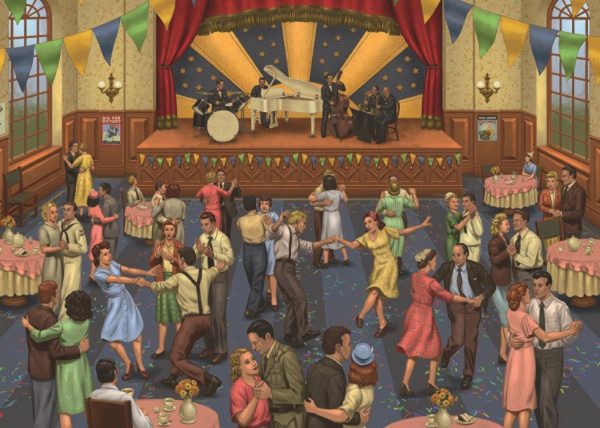
Locate an element on the screen. yellow walls is located at coordinates (86, 12), (501, 5), (500, 75), (595, 97), (0, 90), (64, 101).